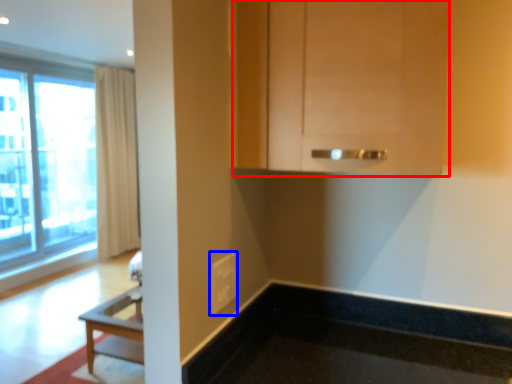
Question: Which object is closer to the camera taking this photo, cabinetry (highlighted by a red box) or electric outlet (highlighted by a blue box)?

Choices:
 (A) cabinetry
 (B) electric outlet

Answer: (A)